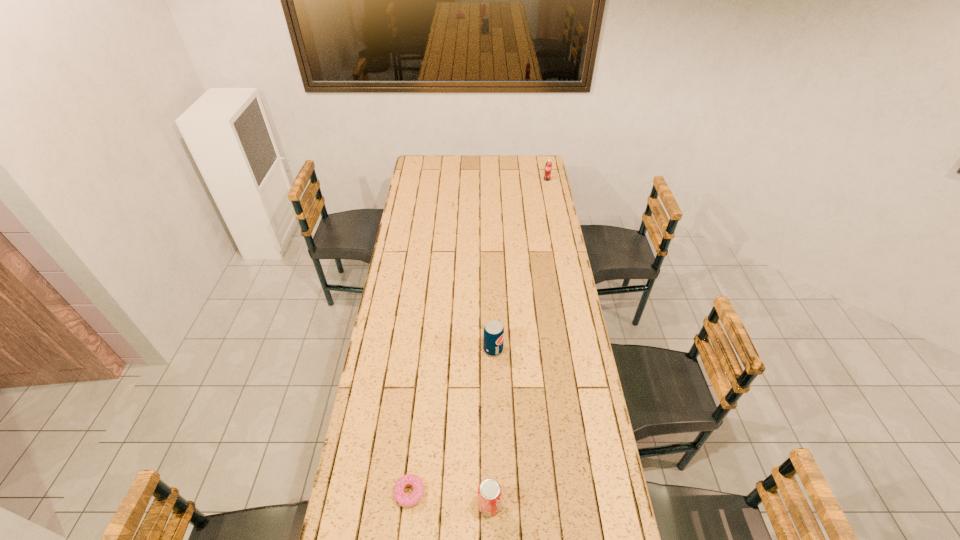
Find the location of a particular element. object that is positioned at the left edge is located at coordinates (404, 500).

Locate an element on the screen. This screenshot has width=960, height=540. object located in the right edge section of the desktop is located at coordinates (548, 167).

Where is `vacant space at the far edge of the desktop`? The image size is (960, 540). vacant space at the far edge of the desktop is located at coordinates (462, 165).

Where is `free space at the left edge of the desktop`? free space at the left edge of the desktop is located at coordinates (381, 366).

Find the location of a particular element. The image size is (960, 540). vacant region at the right edge is located at coordinates (532, 187).

The height and width of the screenshot is (540, 960). Find the location of `free space at the far left corner of the desktop`. free space at the far left corner of the desktop is located at coordinates (420, 157).

In the image, there is a desktop. Identify the location of vacant space at the far right corner. Image resolution: width=960 pixels, height=540 pixels. (537, 158).

Image resolution: width=960 pixels, height=540 pixels. Find the location of `empty space between the doughnut and the nearest soda can`. empty space between the doughnut and the nearest soda can is located at coordinates (449, 499).

You are a GUI agent. You are given a task and a screenshot of the screen. Output one action in this format:
    pyautogui.click(x=<x>, y=<y>)
    Task: Click on the vacant space that's between the farthest soda can and the nearest soda can
    This screenshot has width=960, height=540.
    Given the screenshot: What is the action you would take?
    pyautogui.click(x=518, y=342)

Locate an element on the screen. unoccupied area between the farthest soda can and the third nearest object is located at coordinates (520, 265).